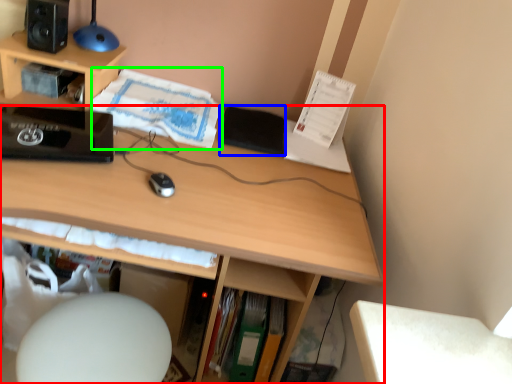
Question: Based on their relative distances, which object is farther from desk (highlighted by a red box)? Choose from notepad (highlighted by a blue box) and book (highlighted by a green box).

Choices:
 (A) notepad
 (B) book

Answer: (A)